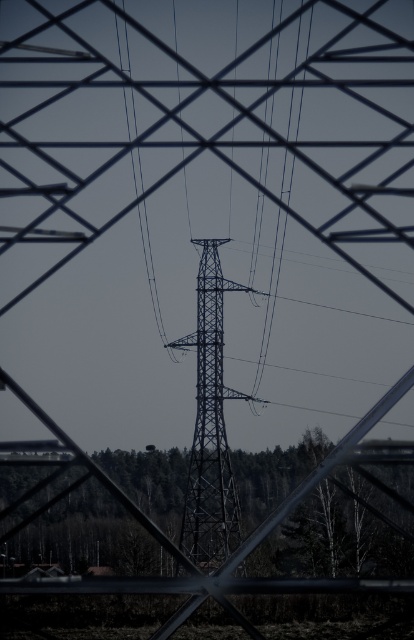
Question: Can you confirm if metallic structure at center is positioned below black wire at center?

Choices:
 (A) yes
 (B) no

Answer: (A)

Question: From the image, what is the correct spatial relationship of metallic structure at center in relation to blue wire at center?

Choices:
 (A) above
 (B) below

Answer: (B)

Question: Based on their relative distances, which object is nearer to the blue wire at center?

Choices:
 (A) metallic structure at center
 (B) black wire at center

Answer: (A)

Question: Does metallic structure at center appear on the right side of blue wire at center?

Choices:
 (A) no
 (B) yes

Answer: (A)

Question: Estimate the real-world distances between objects in this image. Which object is closer to the metallic structure at center?

Choices:
 (A) blue wire at center
 (B) black wire at center

Answer: (A)

Question: Which object appears farthest from the camera in this image?

Choices:
 (A) black wire at center
 (B) metallic structure at center
 (C) blue wire at center

Answer: (B)